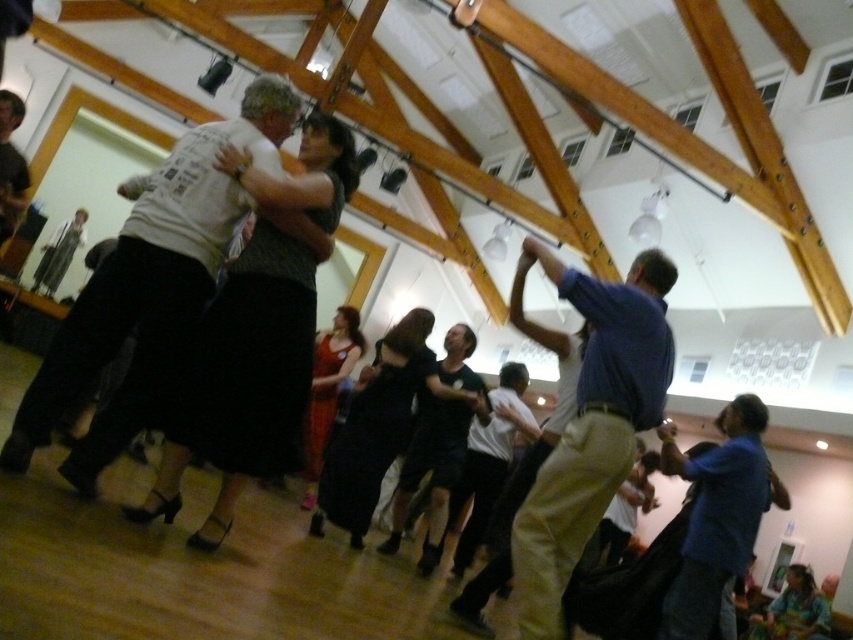
You are standing in the dance hall and notice two points marked on the floor. The first point is at coordinate point(254, 122) and the second is at point(535, 241). Which point is closer to you?

Point(254, 122) is closer to the viewer than point(535, 241).

You are standing in the dance hall and notice two points marked in the scene. Which point, point (535, 636) or point (704, 470), is nearer to you?

Point (535, 636) is closer to the camera than point (704, 470), so it is nearer to you.

You are standing in the dance hall and see a point marked at coordinates (146, 292). Which object is this point located on?

The point is located on the dark gray cotton shirt at upper left.